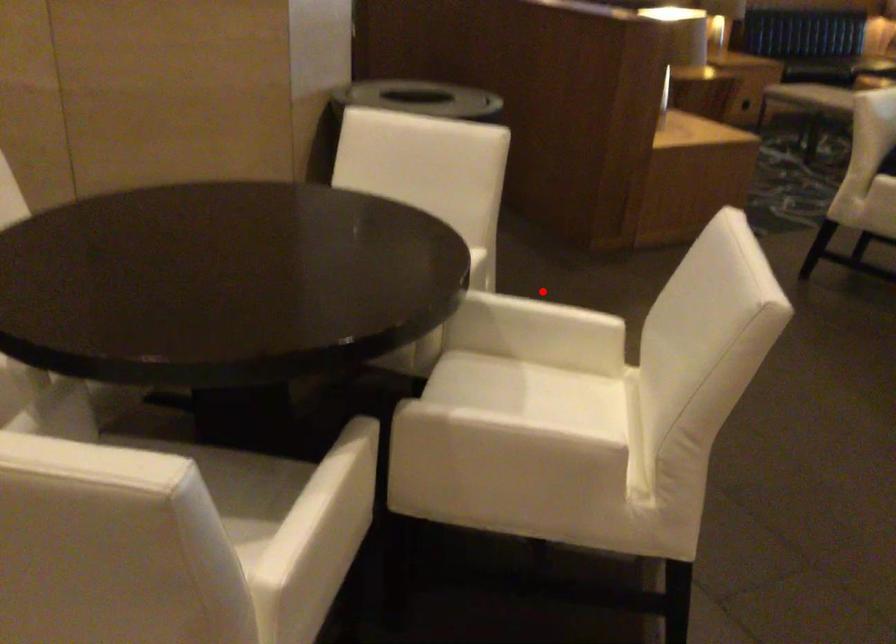
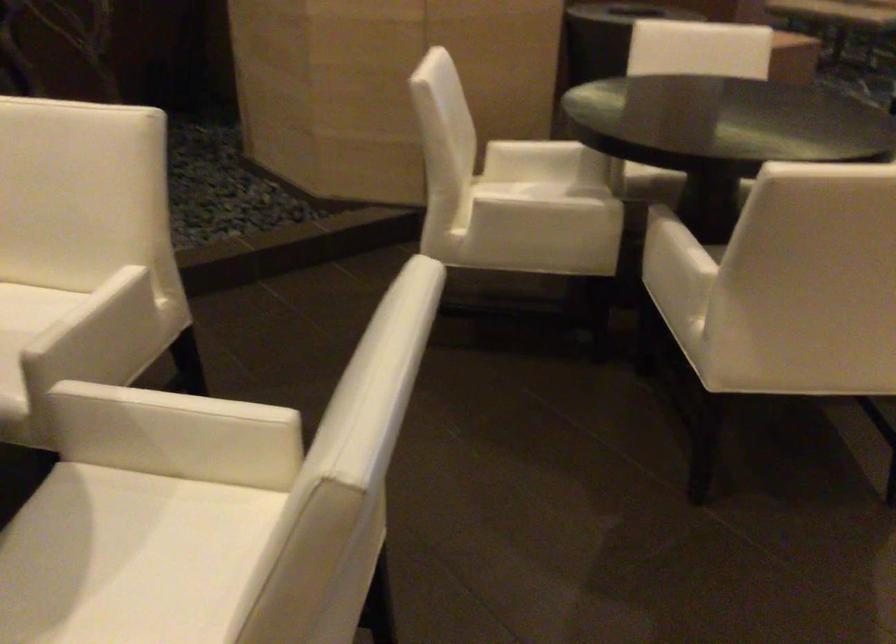
Question: I am providing you with two images of the same scene from different viewpoints. A red point is marked on the first image. Can you still see the location of the red point in image 2?

Choices:
 (A) Yes
 (B) No

Answer: (B)